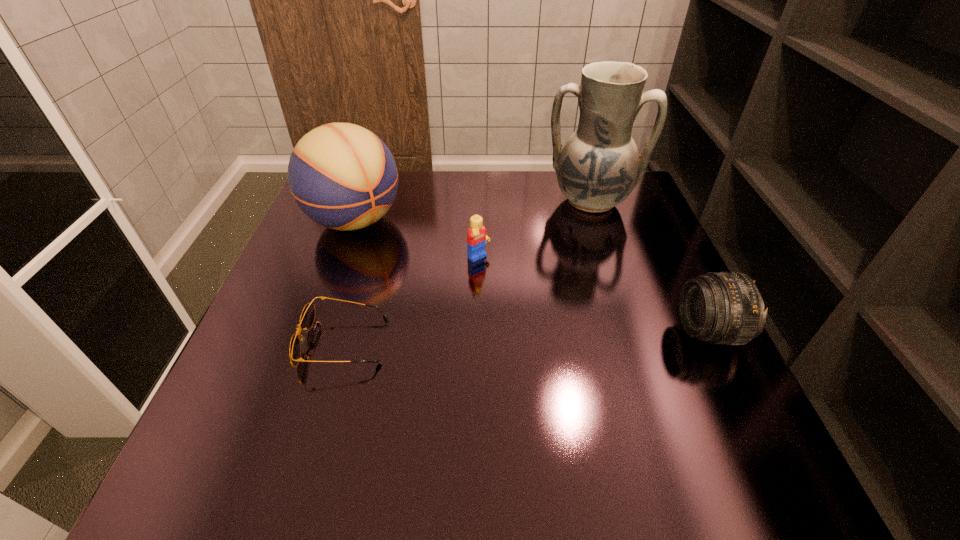
You are a GUI agent. You are given a task and a screenshot of the screen. Output one action in this format:
    pyautogui.click(x=<x>, y=<y>)
    Task: Click on the shortest object
    The height and width of the screenshot is (540, 960).
    Given the screenshot: What is the action you would take?
    pyautogui.click(x=307, y=316)

Find the location of a particular element. the third tallest object is located at coordinates (726, 308).

Locate an element on the screen. the fourth tallest object is located at coordinates (477, 236).

Where is `Lego`? This screenshot has height=540, width=960. Lego is located at coordinates (477, 236).

The height and width of the screenshot is (540, 960). I want to click on basketball, so click(x=342, y=176).

Where is `the tallest object`? Image resolution: width=960 pixels, height=540 pixels. the tallest object is located at coordinates (598, 167).

I want to click on vacant space situated on the front-facing side of the shortest object, so click(246, 343).

Identify the location of free space located 0.110m on the front-facing side of the shortest object. The height and width of the screenshot is (540, 960). (246, 343).

I want to click on vacant space positioned at the front element of the telephoto lens, so click(x=502, y=332).

At what (x,y) coordinates should I click in order to perform the action: click on free space located 0.160m at the front element of the telephoto lens. Please return your answer as a coordinate pair (x, y). The image size is (960, 540). Looking at the image, I should click on (602, 332).